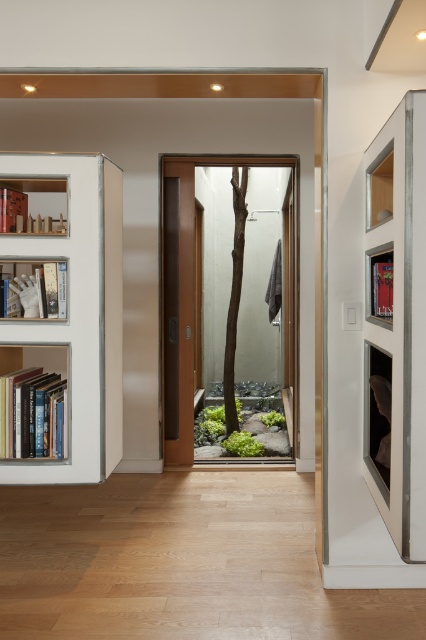
Question: Is white wood bookcase at left to the right of hardcover books at left from the viewer's perspective?

Choices:
 (A) yes
 (B) no

Answer: (A)

Question: Which of the following is the closest to the observer?

Choices:
 (A) (19, 198)
 (B) (16, 372)
 (C) (230, 388)
 (D) (8, 278)

Answer: (D)

Question: Considering the real-world distances, which object is farthest from the transparent glass door at center?

Choices:
 (A) matte white bookshelf at left
 (B) white wood bookcase at left
 (C) brown rough textured tree at center
 (D) matte wood shelf at left

Answer: (A)

Question: Is hardcover books at left in front of matte white bookshelf at left?

Choices:
 (A) yes
 (B) no

Answer: (B)

Question: Does hardcover books at left appear under matte white bookshelf at left?

Choices:
 (A) yes
 (B) no

Answer: (A)

Question: Among these points, which one is nearest to the camera?

Choices:
 (A) (238, 202)
 (B) (224, 456)
 (C) (42, 442)
 (D) (14, 449)

Answer: (D)